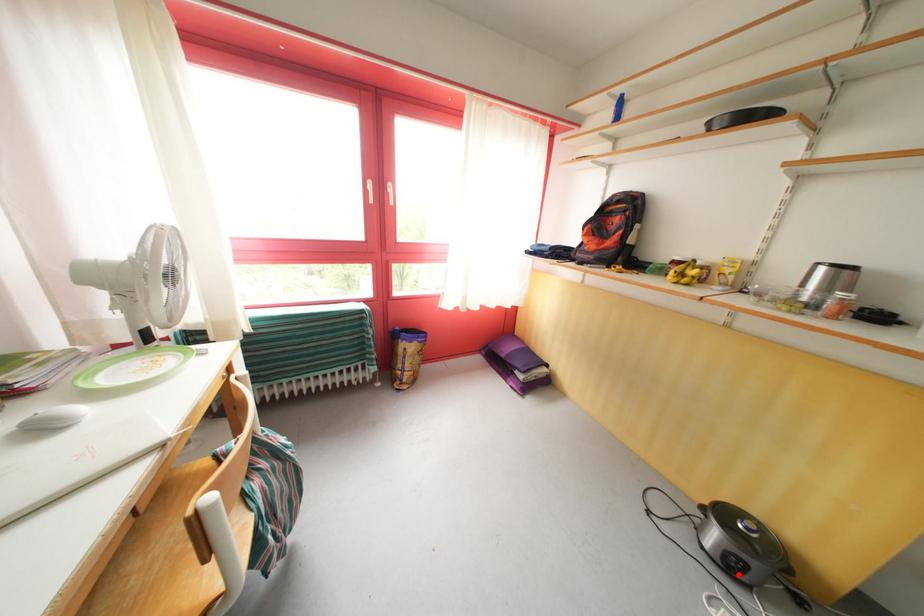
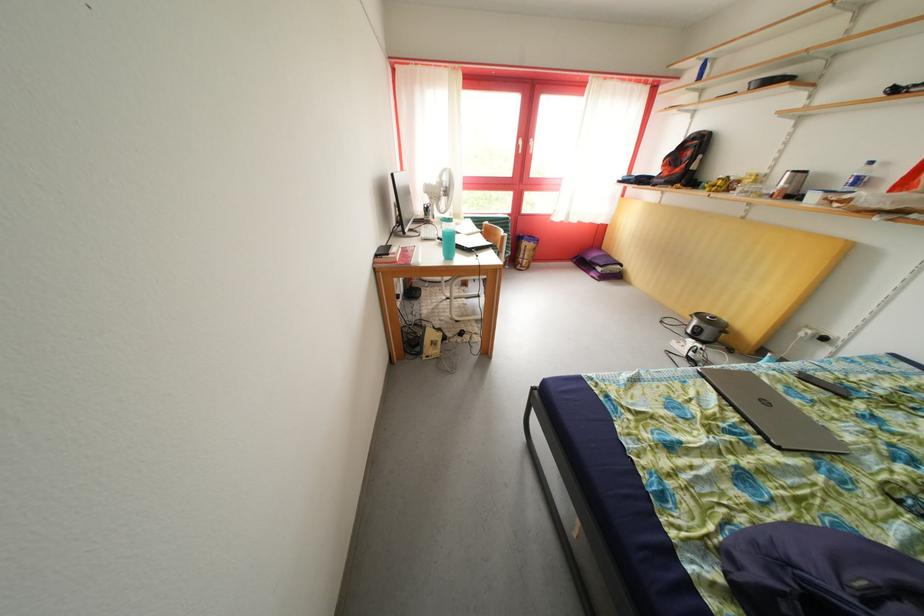
Where in the second image is the point corresponding to the highlighted location from the first image?

(702, 342)